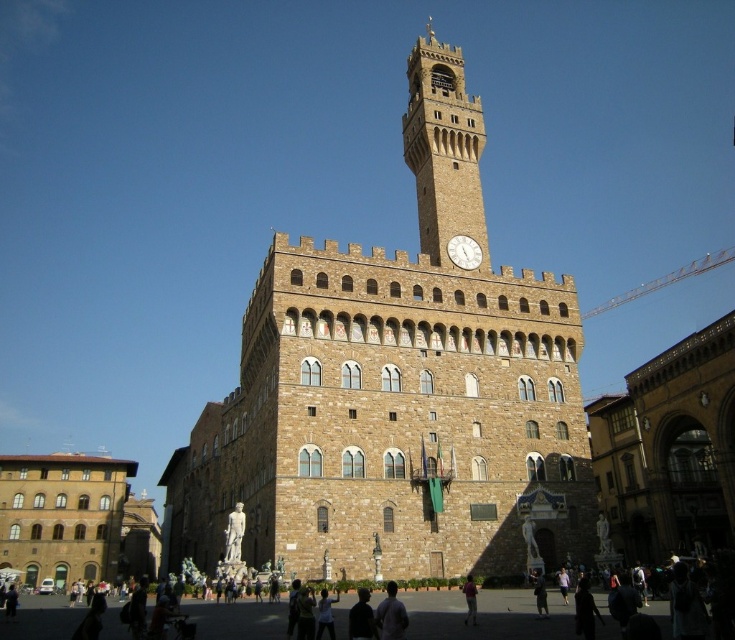
Question: Considering the real-world distances, which object is farthest from the stone clock tower at upper center?

Choices:
 (A) dark brown leather jacket at lower center
 (B) brown stone tower at center

Answer: (A)

Question: Considering the real-world distances, which object is closest to the brown stone tower at center?

Choices:
 (A) white stone clock at center
 (B) light blue shirt at lower center
 (C) dark brown leather jacket at lower center

Answer: (A)

Question: Does white stone clock at center appear over dark brown leather jacket at lower center?

Choices:
 (A) yes
 (B) no

Answer: (A)

Question: Can you confirm if light blue shirt at lower center is positioned below dark brown leather jacket at lower center?

Choices:
 (A) yes
 (B) no

Answer: (B)

Question: Is the position of light blue shirt at lower center less distant than that of white stone clock at center?

Choices:
 (A) yes
 (B) no

Answer: (A)

Question: Which object appears farthest from the camera in this image?

Choices:
 (A) light blue shirt at lower center
 (B) dark brown leather jacket at lower center
 (C) white stone clock at center
 (D) brown stone tower at center

Answer: (C)